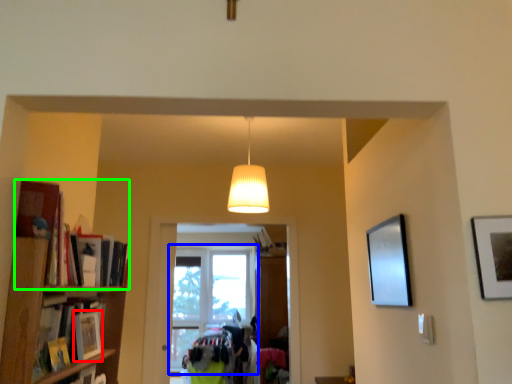
Question: Estimate the real-world distances between objects in this image. Which object is farther from book (highlighted by a red box), window (highlighted by a blue box) or book (highlighted by a green box)?

Choices:
 (A) window
 (B) book

Answer: (A)